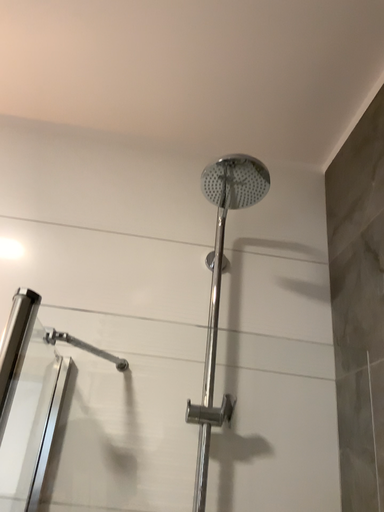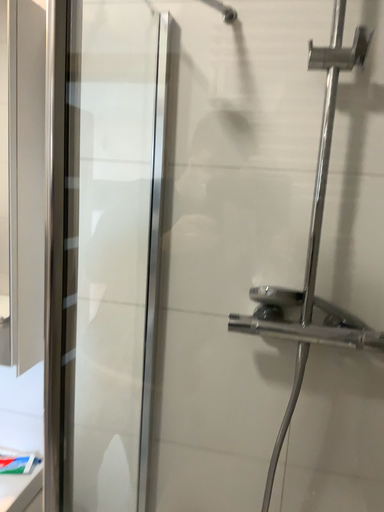
Question: How did the camera likely rotate when shooting the video?

Choices:
 (A) rotated upward
 (B) rotated downward

Answer: (B)